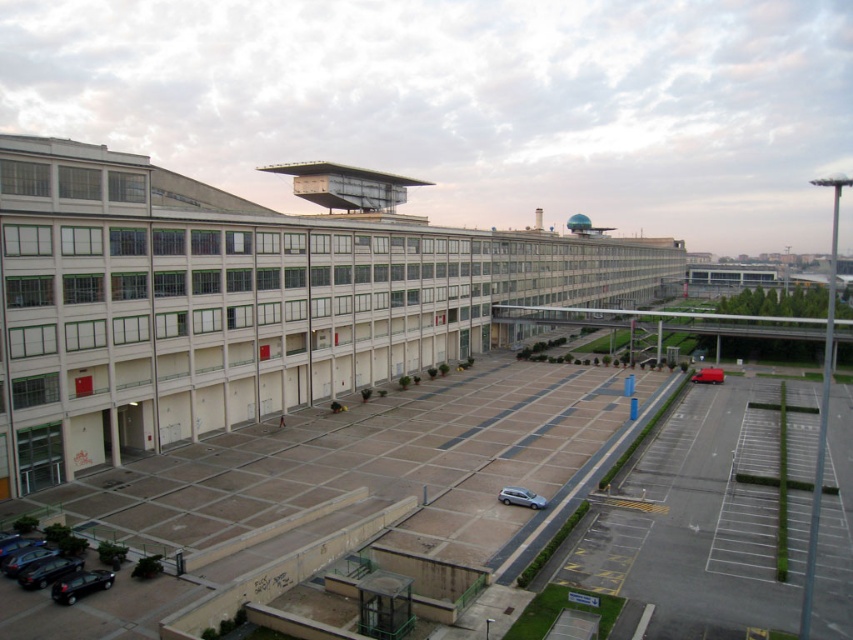
You are standing in front of the industrial building and want to take a photo. You notice two points marked on the ground at coordinates point (x=86, y=579) and point (x=537, y=493). Which point is closer to you when you take the photo?

Point (x=86, y=579) is closer to the camera than point (x=537, y=493), so it will appear closer to you in the photo.

You are standing at the entrance of the industrial building and want to find the shiny black car at lower left. Based on the coordinates provided, can you determine its position relative to your current location?

The shiny black car at lower left is located at coordinates point (80,584), which places it to the lower left relative to your position at the entrance of the building.

You are a delivery driver approaching the white concrete parking garage at center and the satin silver car at center. Based on the scene, which object is closer to you as you arrive?

The white concrete parking garage at center is closer to you because it is positioned in front of the satin silver car at center, meaning the garage is nearer to your viewpoint as you approach.